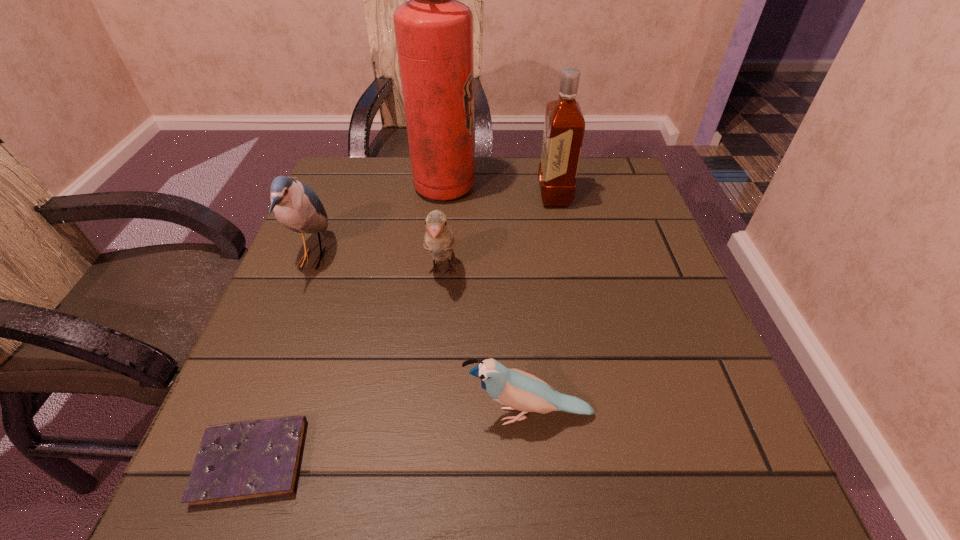
What are the coordinates of `the tallest object` in the screenshot? It's located at (434, 31).

Image resolution: width=960 pixels, height=540 pixels. In order to click on the fifth shortest object in this screenshot , I will do `click(564, 126)`.

This screenshot has height=540, width=960. Identify the location of the leftmost bird. (296, 206).

At what (x,y) coordinates should I click in order to perform the action: click on the fourth shortest object. Please return your answer as a coordinate pair (x, y). The image size is (960, 540). Looking at the image, I should click on (296, 206).

The height and width of the screenshot is (540, 960). What are the coordinates of `the second bird from left to right` in the screenshot? It's located at (439, 240).

Where is `the nearest bird`? The image size is (960, 540). the nearest bird is located at coordinates click(521, 391).

Locate an element on the screen. The image size is (960, 540). the shortest object is located at coordinates (244, 461).

This screenshot has width=960, height=540. I want to click on free space located 0.310m on the label side of the fire extinguisher, so click(595, 187).

Locate an element on the screen. Image resolution: width=960 pixels, height=540 pixels. vacant space situated on the front label of the liquor is located at coordinates (447, 196).

This screenshot has width=960, height=540. Identify the location of free space located on the front label of the liquor. (515, 196).